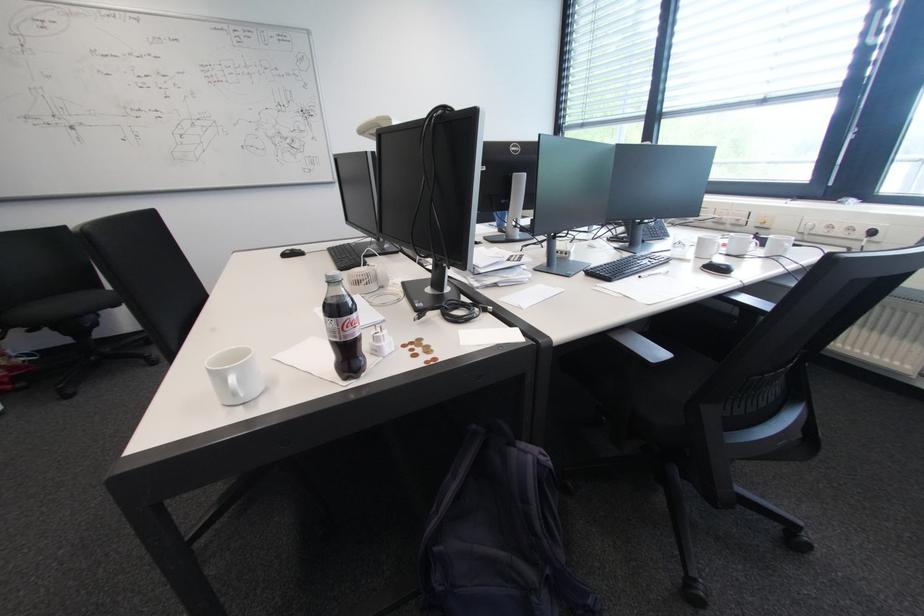
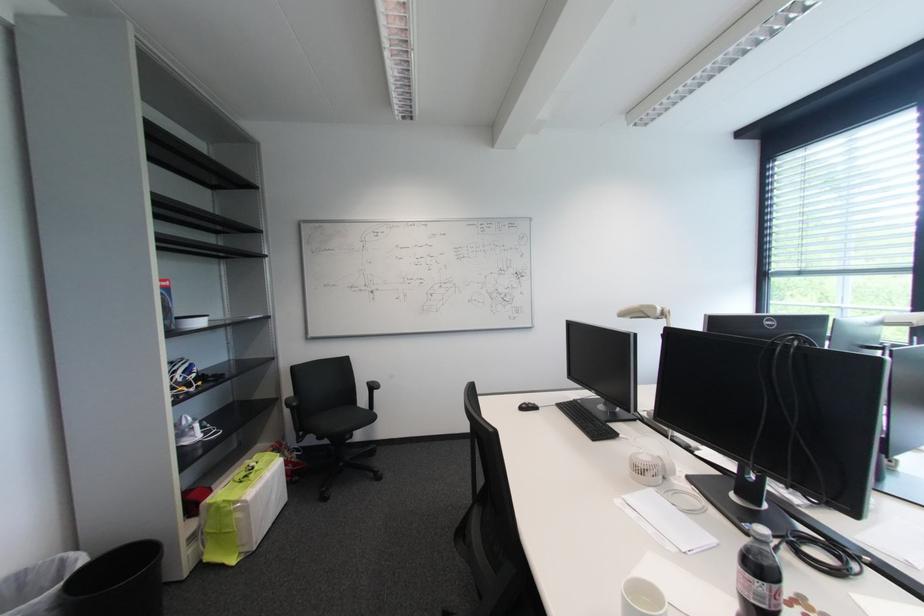
Locate, in the second image, the point that corresponds to (x=371, y=285) in the first image.

(657, 475)